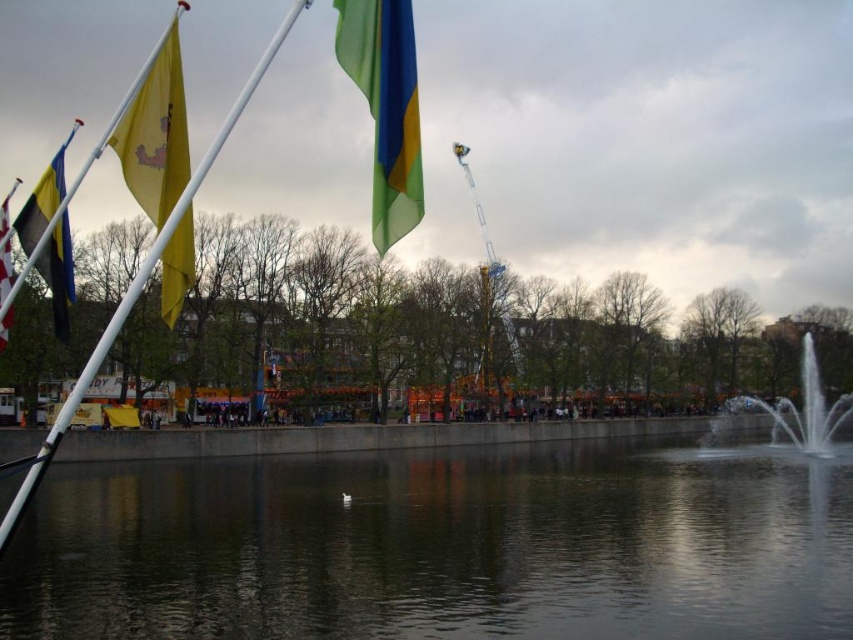
Question: Can you confirm if transparent water at center is wider than translucent green flag at upper center?

Choices:
 (A) no
 (B) yes

Answer: (B)

Question: Considering the real-world distances, which object is closest to the translucent green flag at upper center?

Choices:
 (A) matte black flag at left
 (B) white metallic pole at left
 (C) blue and yellow fabric flag at left

Answer: (A)

Question: Can you confirm if translucent green flag at upper center is positioned to the right of white metallic pole at left?

Choices:
 (A) yes
 (B) no

Answer: (A)

Question: Is yellow matte flag at left above matte black flag at left?

Choices:
 (A) no
 (B) yes

Answer: (A)

Question: Which of the following is the closest to the observer?

Choices:
 (A) (840, 561)
 (B) (805, 376)
 (C) (61, 326)
 (D) (392, 84)

Answer: (D)

Question: Which object is positioned farthest from the translucent green flag at upper center?

Choices:
 (A) clear glass fountain at right
 (B) yellow matte flag at left
 (C) white metallic pole at left
 (D) transparent water at center

Answer: (A)